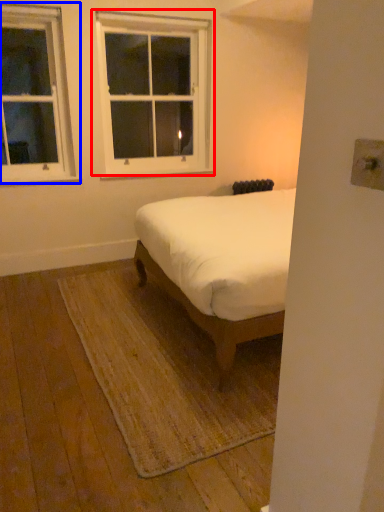
Question: Which point is further to the camera, window (highlighted by a red box) or window (highlighted by a blue box)?

Choices:
 (A) window
 (B) window

Answer: (A)